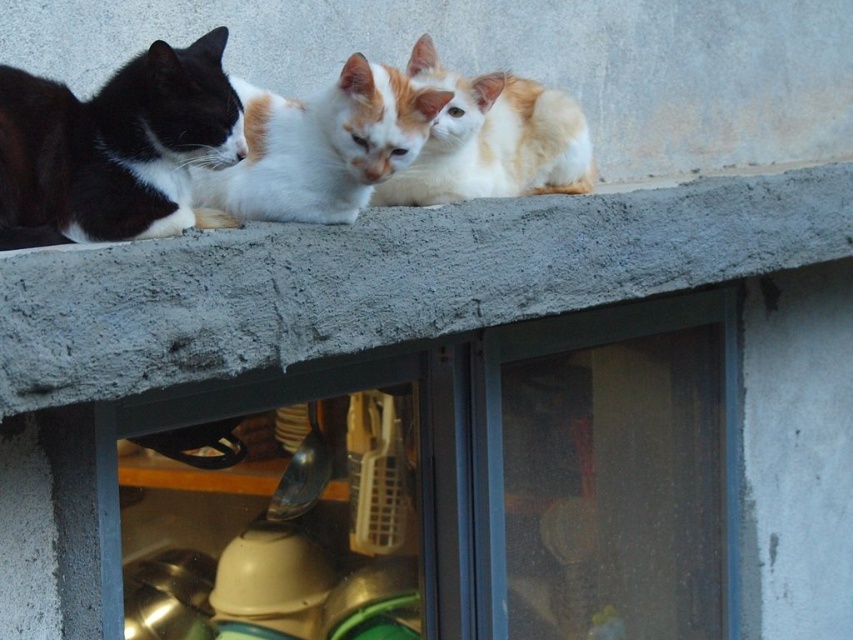
Question: Does concrete ledge at upper center have a greater width compared to white fur cat at center?

Choices:
 (A) no
 (B) yes

Answer: (B)

Question: Among these objects, which one is nearest to the camera?

Choices:
 (A) transparent plastic window at center
 (B) black and white fur cat at left
 (C) orange and white fur at upper center
 (D) concrete ledge at upper center

Answer: (D)

Question: Can you confirm if concrete ledge at upper center is positioned above transparent plastic window at center?

Choices:
 (A) no
 (B) yes

Answer: (B)

Question: Is the position of concrete ledge at upper center more distant than that of orange and white fur at upper center?

Choices:
 (A) yes
 (B) no

Answer: (B)

Question: Estimate the real-world distances between objects in this image. Which object is farther from the black and white fur cat at left?

Choices:
 (A) concrete ledge at upper center
 (B) transparent plastic window at center
 (C) white fur cat at center
 (D) orange and white fur at upper center

Answer: (B)

Question: Among these points, which one is farthest from the camera?

Choices:
 (A) (651, 609)
 (B) (155, 209)
 (C) (196, 177)

Answer: (A)